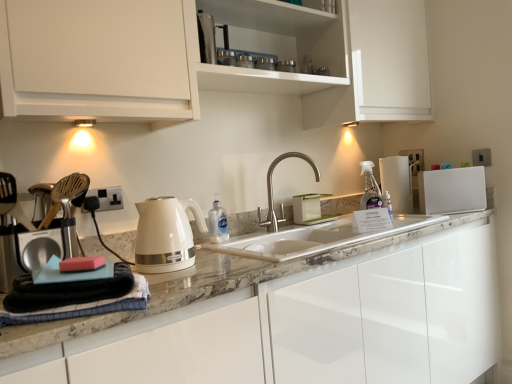
This screenshot has height=384, width=512. What are the coordinates of `free space in front of white glossy electric kettle at center-left` in the screenshot? It's located at (187, 278).